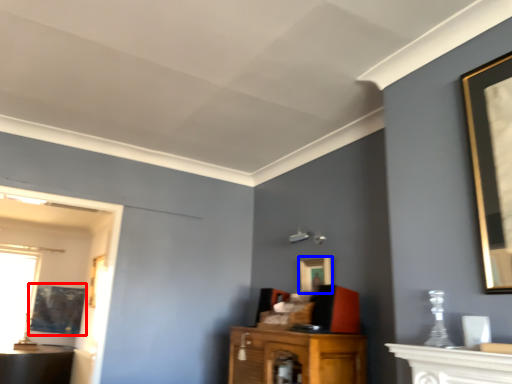
Question: Which object appears farthest to the camera in this image, picture frame (highlighted by a red box) or picture frame (highlighted by a blue box)?

Choices:
 (A) picture frame
 (B) picture frame

Answer: (A)